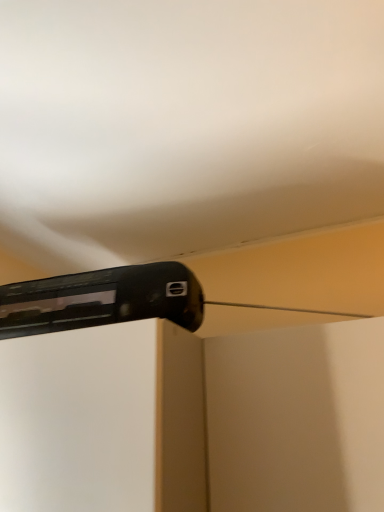
Measure the distance between black matte phone at upper left and camera.

65.30 centimeters.

The width and height of the screenshot is (384, 512). What do you see at coordinates (102, 298) in the screenshot? I see `black matte phone at upper left` at bounding box center [102, 298].

The height and width of the screenshot is (512, 384). What are the coordinates of `black matte phone at upper left` in the screenshot? It's located at (102, 298).

I want to click on black matte phone at upper left, so click(102, 298).